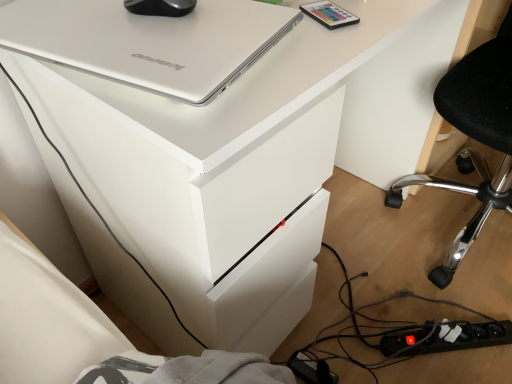
The height and width of the screenshot is (384, 512). Find the location of `free space in front of matte plastic remote control at upper right`. free space in front of matte plastic remote control at upper right is located at coordinates (310, 52).